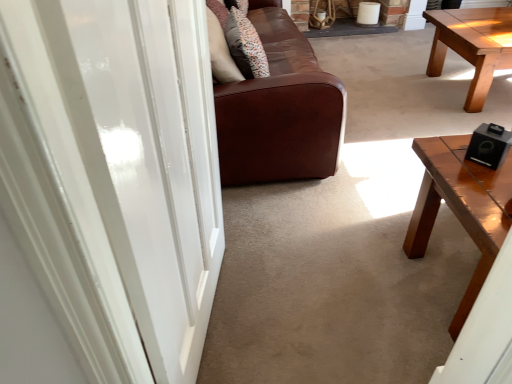
Question: Can you confirm if black matte speaker at right is bigger than patterned fabric pillow at center?

Choices:
 (A) no
 (B) yes

Answer: (A)

Question: Is black matte speaker at right oriented away from patterned fabric pillow at center?

Choices:
 (A) yes
 (B) no

Answer: (B)

Question: Is black matte speaker at right smaller than patterned fabric pillow at center?

Choices:
 (A) no
 (B) yes

Answer: (B)

Question: Is black matte speaker at right next to patterned fabric pillow at center and touching it?

Choices:
 (A) yes
 (B) no

Answer: (B)

Question: From a real-world perspective, is black matte speaker at right physically above patterned fabric pillow at center?

Choices:
 (A) no
 (B) yes

Answer: (A)

Question: From the image's perspective, is white glossy door at center located above or below patterned fabric pillow at center?

Choices:
 (A) above
 (B) below

Answer: (B)

Question: Considering the positions of white glossy door at center and patterned fabric pillow at center in the image, is white glossy door at center bigger or smaller than patterned fabric pillow at center?

Choices:
 (A) small
 (B) big

Answer: (B)

Question: Is point (134, 97) positioned closer to the camera than point (242, 69)?

Choices:
 (A) farther
 (B) closer

Answer: (B)

Question: Do you think white glossy door at center is within patterned fabric pillow at center, or outside of it?

Choices:
 (A) outside
 (B) inside

Answer: (A)

Question: Is shiny brown wood coffee table at right in front of or behind patterned fabric pillow at center in the image?

Choices:
 (A) behind
 (B) front

Answer: (B)

Question: In terms of width, does shiny brown wood coffee table at right look wider or thinner when compared to patterned fabric pillow at center?

Choices:
 (A) wide
 (B) thin

Answer: (A)

Question: From their relative heights in the image, would you say shiny brown wood coffee table at right is taller or shorter than patterned fabric pillow at center?

Choices:
 (A) tall
 (B) short

Answer: (A)

Question: In terms of size, does shiny brown wood coffee table at right appear bigger or smaller than patterned fabric pillow at center?

Choices:
 (A) big
 (B) small

Answer: (A)

Question: From a real-world perspective, is patterned fabric pillow at center above or below black matte speaker at right?

Choices:
 (A) below
 (B) above

Answer: (B)

Question: Is point (229, 49) positioned closer to the camera than point (493, 147)?

Choices:
 (A) farther
 (B) closer

Answer: (A)